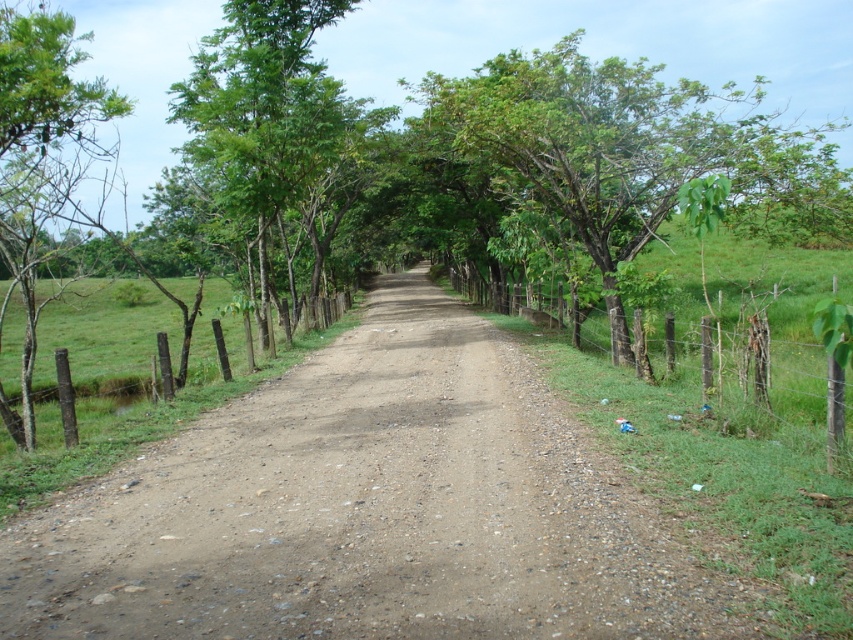
Question: Among these objects, which one is nearest to the camera?

Choices:
 (A) dull brown dirt track at center
 (B) green leafy tree at upper left
 (C) brown wooden fence at left
 (D) green leafy tree at center

Answer: (A)

Question: Which point appears closest to the camera in this image?

Choices:
 (A) (315, 154)
 (B) (18, 636)
 (C) (488, 292)
 (D) (207, 349)

Answer: (B)

Question: Is dull brown dirt track at center to the left of green leafy tree at center from the viewer's perspective?

Choices:
 (A) no
 (B) yes

Answer: (B)

Question: Is green leafy tree at center smaller than brown wooden fence at left?

Choices:
 (A) yes
 (B) no

Answer: (B)

Question: From the image, what is the correct spatial relationship of green leafy tree at center in relation to wooden post fence at right?

Choices:
 (A) right
 (B) left

Answer: (A)

Question: Estimate the real-world distances between objects in this image. Which object is farther from the green leafy tree at upper left?

Choices:
 (A) wooden post fence at right
 (B) dull brown dirt track at center

Answer: (A)